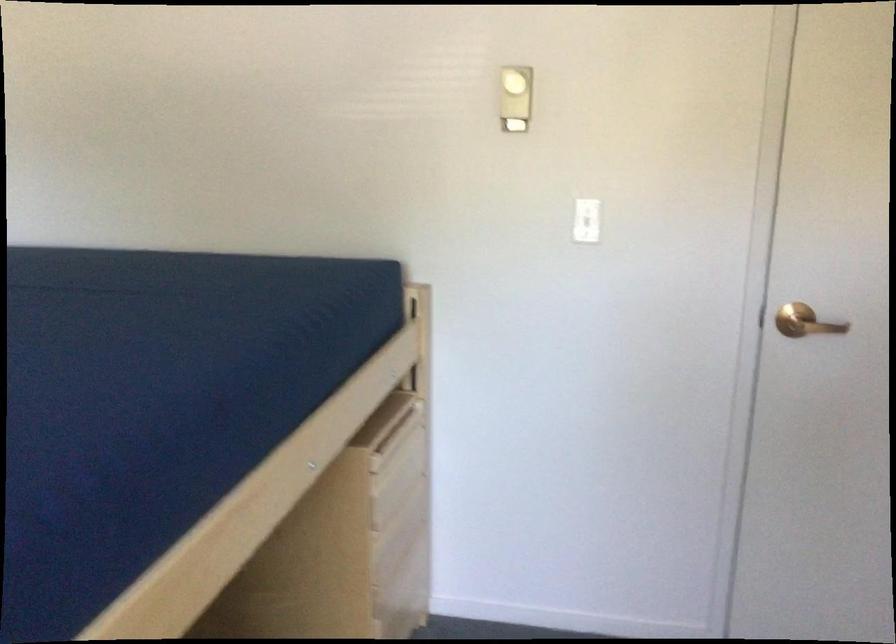
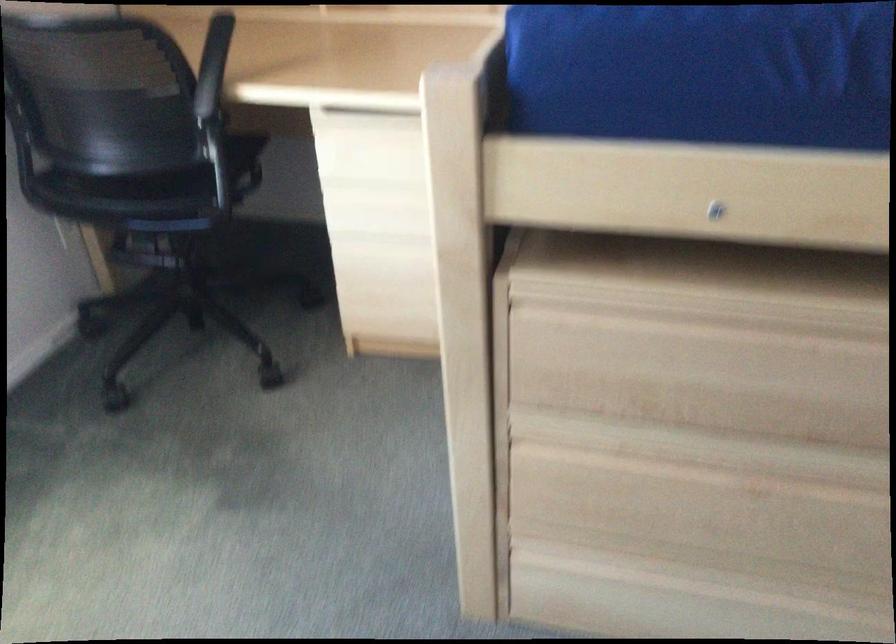
Based on the continuous images, in which direction is the camera rotating?

The rotation direction of the camera is left-down.